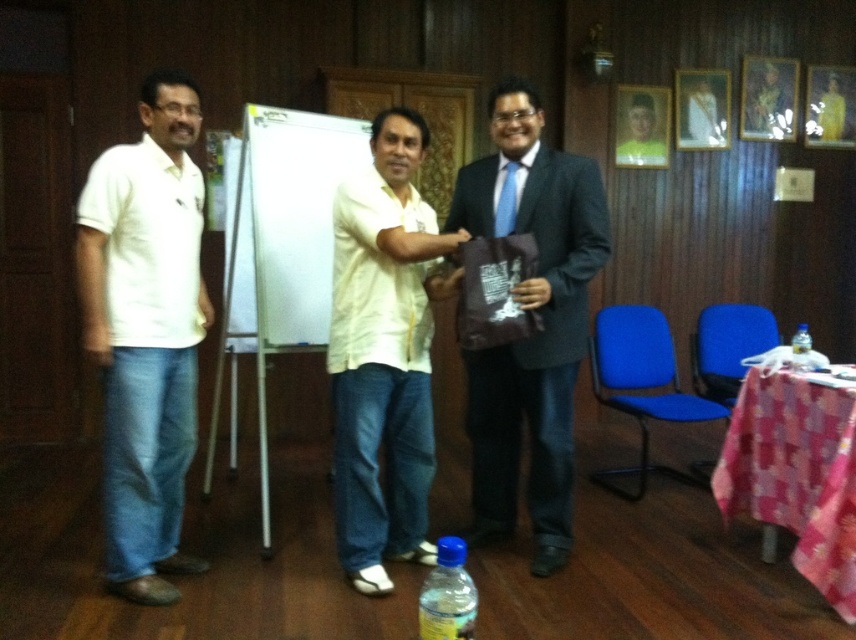
You are standing in the room with the three men. You need to locate the matte brown bag at center. Where exactly is it positioned in the room?

The matte brown bag at center is located at point [541,320] in the room.

In the scene shown: You are a photographer setting up a shoot in the room described. You notice the white cotton shirt at left and the translucent plastic bottle at center. Which object is blocking the view of the other?

The white cotton shirt at left is positioned over the translucent plastic bottle at center, so the shirt is blocking the view of the bottle.

In the scene shown: You are a photographer setting up for a group photo in the room. You need to ensure that all subjects are visible. Given the white cotton shirt at left and the translucent plastic bottle at center, which one is taller and might block the view of the other?

The white cotton shirt at left is much taller than the translucent plastic bottle at center, so it might block the view of the bottle if positioned in front.